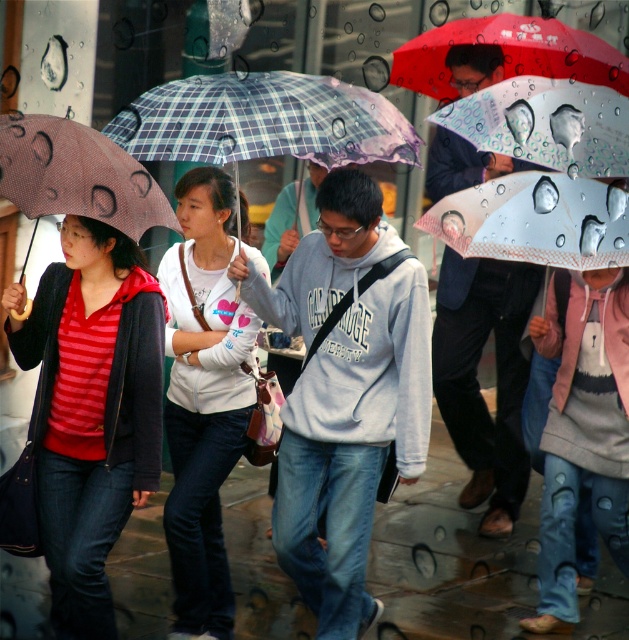
Measure the distance between matte black jacket at left and white matte jacket at center.

matte black jacket at left and white matte jacket at center are 29.76 inches apart from each other.

Who is higher up, matte black jacket at left or white matte jacket at center?

white matte jacket at center is above.

Find the location of a particular element. matte black jacket at left is located at coordinates (91, 408).

Between white matte jacket at center and matte brown umbrella at left, which one appears on the left side from the viewer's perspective?

matte brown umbrella at left is more to the left.

Between point (242, 193) and point (81, 138), which one is positioned behind?

Positioned behind is point (242, 193).

You are a GUI agent. You are given a task and a screenshot of the screen. Output one action in this format:
    pyautogui.click(x=<x>, y=<y>)
    Task: Click on the white matte jacket at center
    The height and width of the screenshot is (640, 629).
    Given the screenshot: What is the action you would take?
    pyautogui.click(x=203, y=397)

Between point (511, 202) and point (6, 134), which one is positioned behind?

Point (511, 202)

Is the position of white glossy umbrella at center less distant than that of matte brown umbrella at left?

That is False.

Is point (560, 173) farther from camera compared to point (175, 224)?

Yes, it is behind point (175, 224).

At what (x,y) coordinates should I click in order to perform the action: click on white glossy umbrella at center. Please return your answer as a coordinate pair (x, y). Image resolution: width=629 pixels, height=640 pixels. Looking at the image, I should click on [x=535, y=220].